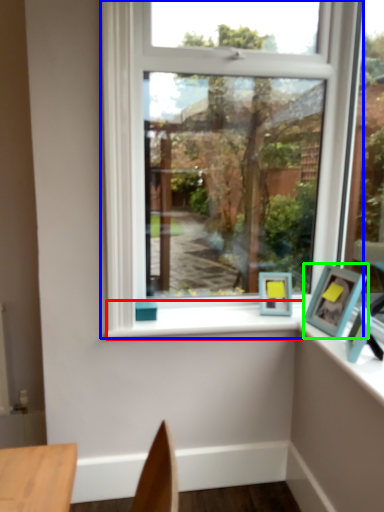
Question: Which object is positioned closest to window sill (highlighted by a red box)? Select from window (highlighted by a blue box) and picture frame (highlighted by a green box).

Choices:
 (A) window
 (B) picture frame

Answer: (A)